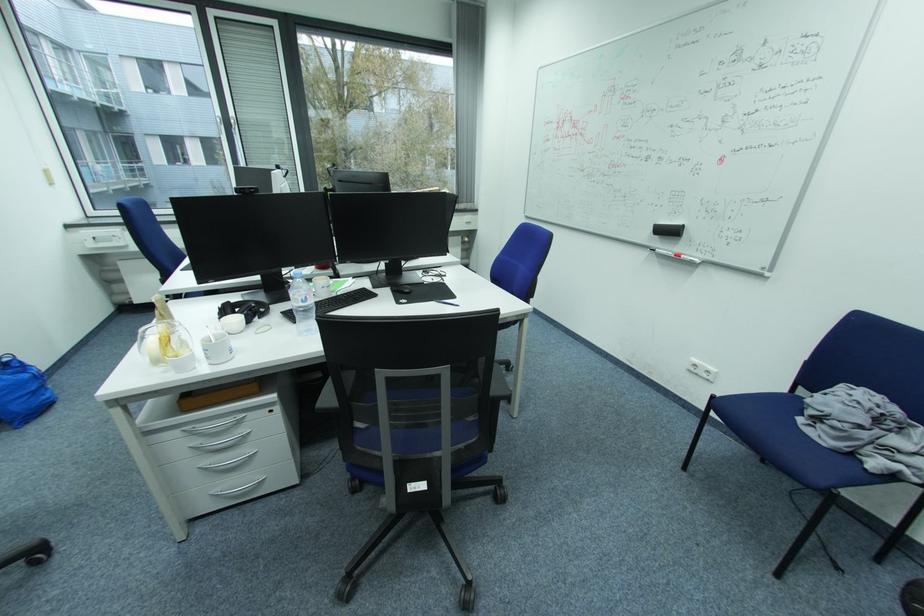
In order to click on blue tote bag in this screenshot , I will do `click(21, 392)`.